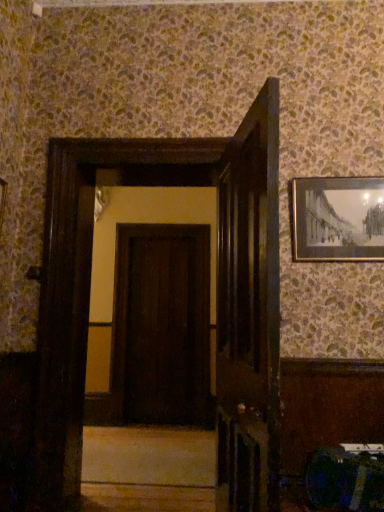
The image size is (384, 512). Identify the location of vacant space underneath dark brown wood door at center, marked as the second door in a right-to-left arrangement (from a real-world perspective). (165, 423).